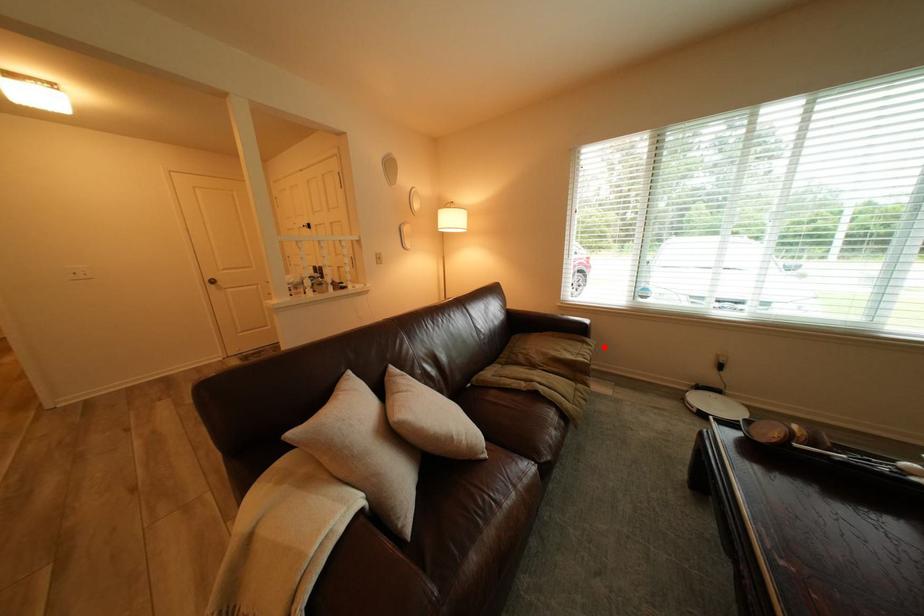
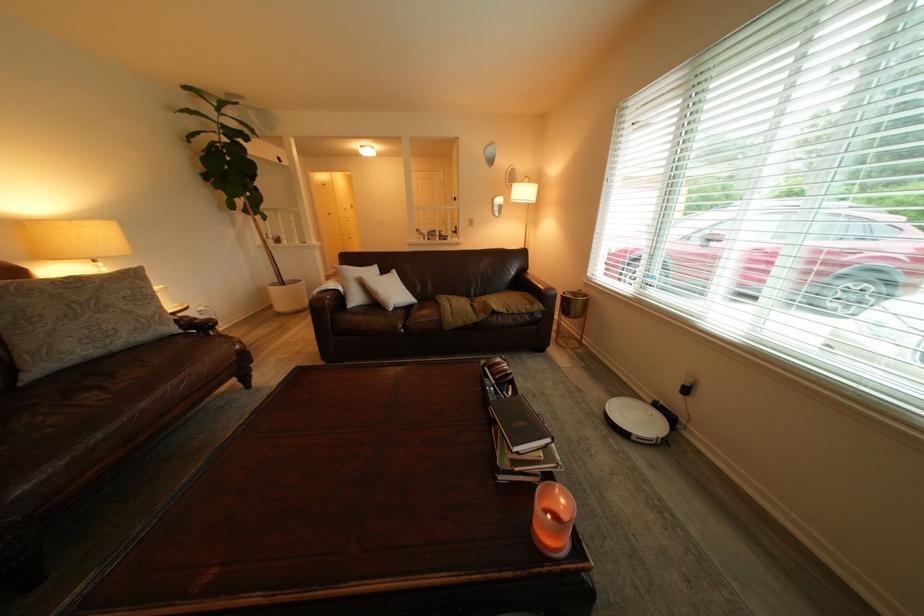
Find the pixel in the second image that matches the highlighted location in the first image.

(546, 309)